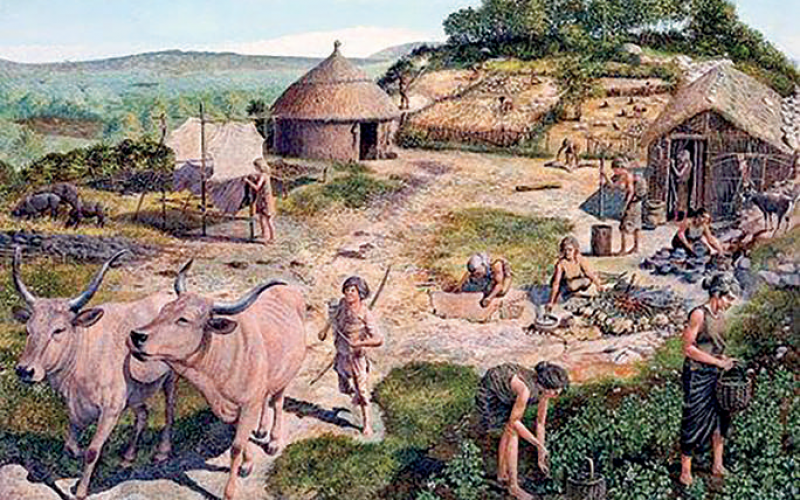
Locate an element on the screen. This screenshot has width=800, height=500. laundry is located at coordinates (238, 153), (192, 139).